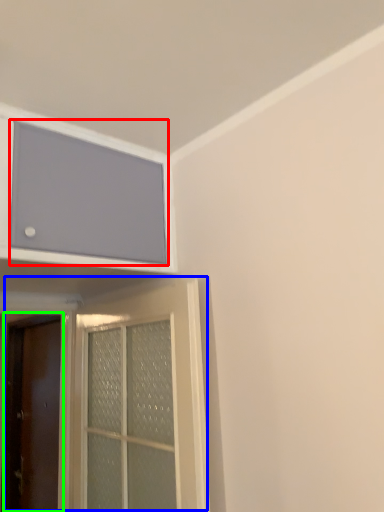
Question: Which object is positioned closest to window screen (highlighted by a red box)? Select from door (highlighted by a blue box) and door (highlighted by a green box).

Choices:
 (A) door
 (B) door

Answer: (A)